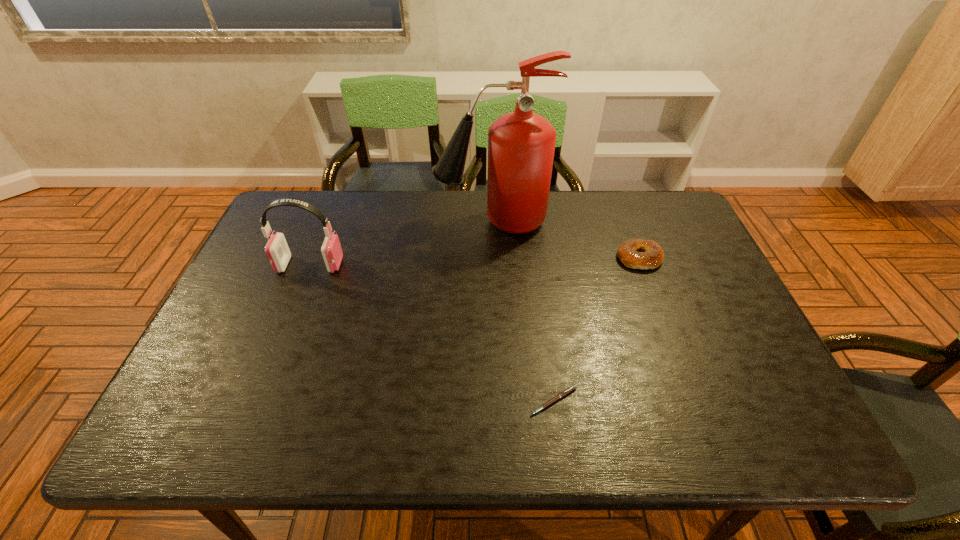
This screenshot has height=540, width=960. I want to click on vacant space that is in between the pen and the bagel, so click(597, 329).

Identify the location of free point between the farthest object and the leftmost object. (401, 243).

Locate an element on the screen. free point between the third shortest object and the shortest object is located at coordinates (432, 333).

I want to click on object that is the closest to the third shortest object, so click(x=521, y=144).

What are the coordinates of `the third closest object to the rightmost object` in the screenshot? It's located at (278, 253).

The height and width of the screenshot is (540, 960). Identify the location of vacant space that satisfies the following two spatial constraints: 1. with the nozzle aimed from the fire extinguisher; 2. on the back side of the rightmost object. (493, 258).

I want to click on vacant region that satisfies the following two spatial constraints: 1. with the nozzle aimed from the farthest object; 2. on the back side of the rightmost object, so click(x=493, y=258).

Locate an element on the screen. vacant region that satisfies the following two spatial constraints: 1. with the nozzle aimed from the farthest object; 2. on the back side of the rightmost object is located at coordinates (493, 258).